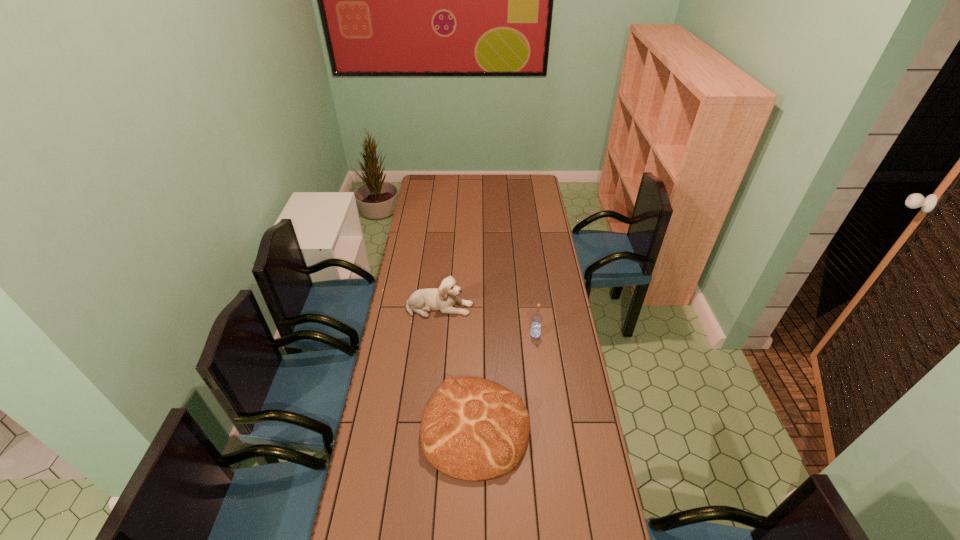
This screenshot has height=540, width=960. Find the location of `free space that satisfies the following two spatial constraints: 1. on the front-facing side of the farthest object; 2. on the right side of the bread`. free space that satisfies the following two spatial constraints: 1. on the front-facing side of the farthest object; 2. on the right side of the bread is located at coordinates (428, 427).

Where is `free point that satisfies the following two spatial constraints: 1. on the front-facing side of the puppy; 2. on the back side of the bread`? This screenshot has width=960, height=540. free point that satisfies the following two spatial constraints: 1. on the front-facing side of the puppy; 2. on the back side of the bread is located at coordinates (428, 427).

Locate an element on the screen. This screenshot has height=540, width=960. free point that satisfies the following two spatial constraints: 1. on the front-facing side of the second nearest object; 2. on the right side of the farthest object is located at coordinates (437, 334).